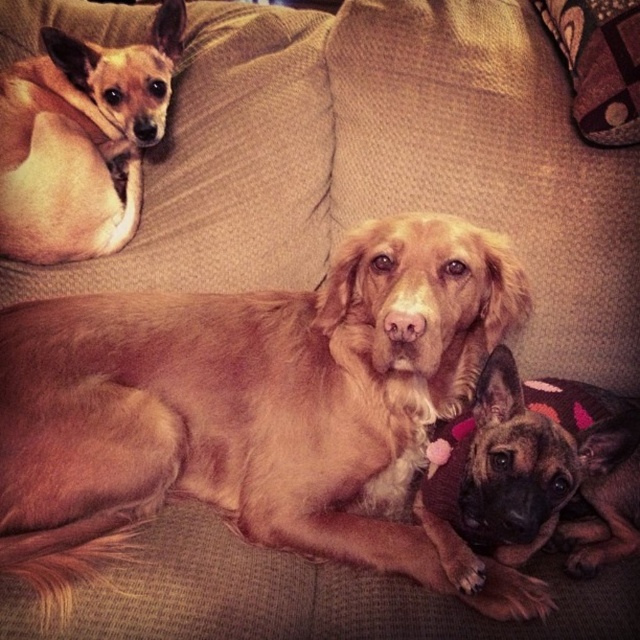
You are an AI analyzing the image. The coordinate system has the origin at the bottom left corner of the image. The light brown fur at upper left is located at what coordinates?

The light brown fur at upper left is located at coordinates point (81, 140).

You are a photographer trying to capture a closeup of the light brown fur at upper left and the brown furry dog at lower right. Which one will require you to adjust your camera focus to a longer distance?

The light brown fur at upper left requires adjusting the camera focus to a longer distance because it is taller than the brown furry dog at lower right.

You are a photographer trying to capture a closeup of the light brown fur at upper left and the brown furry dog at lower right. Which one is located more to the left side of the image?

The light brown fur at upper left is positioned on the left side of brown furry dog at lower right, so the light brown fur at upper left is more to the left side of the image.